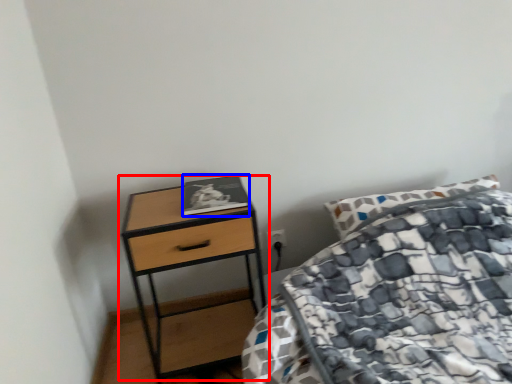
Question: Which object appears farthest to the camera in this image, table (highlighted by a red box) or book (highlighted by a blue box)?

Choices:
 (A) table
 (B) book

Answer: (B)